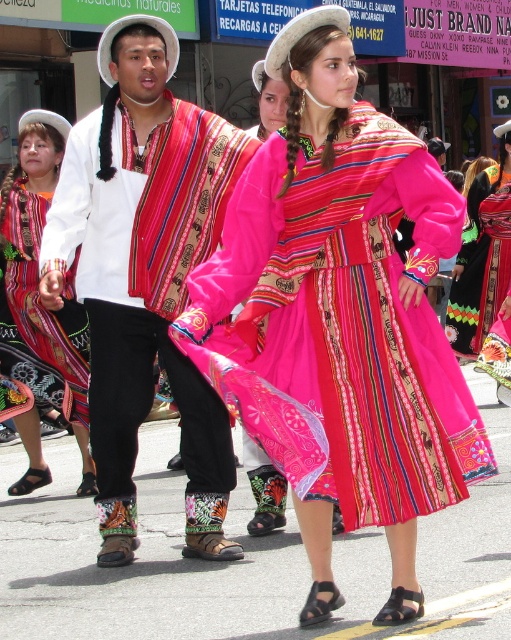
What do you see at coordinates (145, 273) in the screenshot? This screenshot has height=640, width=511. I see `matte white shirt at center` at bounding box center [145, 273].

Is the position of matte white shirt at center less distant than that of matte black dress at center?

Yes, matte white shirt at center is in front of matte black dress at center.

Describe the element at coordinates (145, 273) in the screenshot. Image resolution: width=511 pixels, height=640 pixels. I see `matte white shirt at center` at that location.

Identify the location of matte white shirt at center. This screenshot has height=640, width=511. (145, 273).

Is velvet pink dress at center smaller than matte white shirt at center?

Indeed, velvet pink dress at center has a smaller size compared to matte white shirt at center.

This screenshot has height=640, width=511. Describe the element at coordinates (340, 324) in the screenshot. I see `velvet pink dress at center` at that location.

Measure the distance between velvet pink dress at center and camera.

A distance of 4.01 meters exists between velvet pink dress at center and camera.

Find the location of a particular element. The height and width of the screenshot is (640, 511). velvet pink dress at center is located at coordinates (340, 324).

Can you confirm if velvet pink dress at center is taller than matte black dress at center?

No, velvet pink dress at center is not taller than matte black dress at center.

Between point (384, 358) and point (49, 161), which one is positioned behind?

Positioned behind is point (49, 161).

Is point (359, 248) closer to camera compared to point (82, 433)?

Yes, point (359, 248) is closer to viewer.

Find the location of a particular element. velvet pink dress at center is located at coordinates (340, 324).